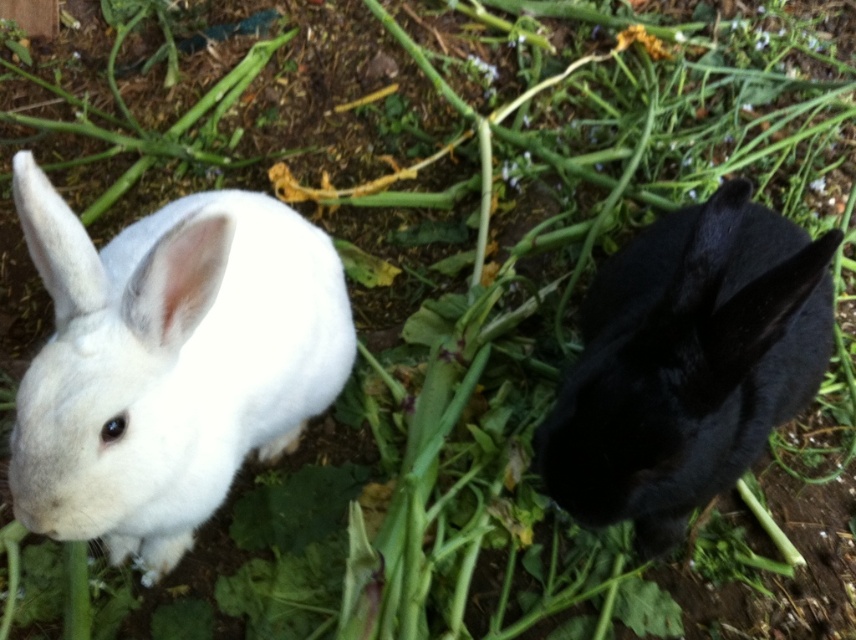
Is point (159, 540) closer to camera compared to point (669, 365)?

No, it is not.

Is white fluffy rabbit at left further to the viewer compared to black matte rabbit at right?

No.

Is point (239, 448) less distant than point (626, 470)?

No, it is not.

The image size is (856, 640). I want to click on white fluffy rabbit at left, so click(168, 364).